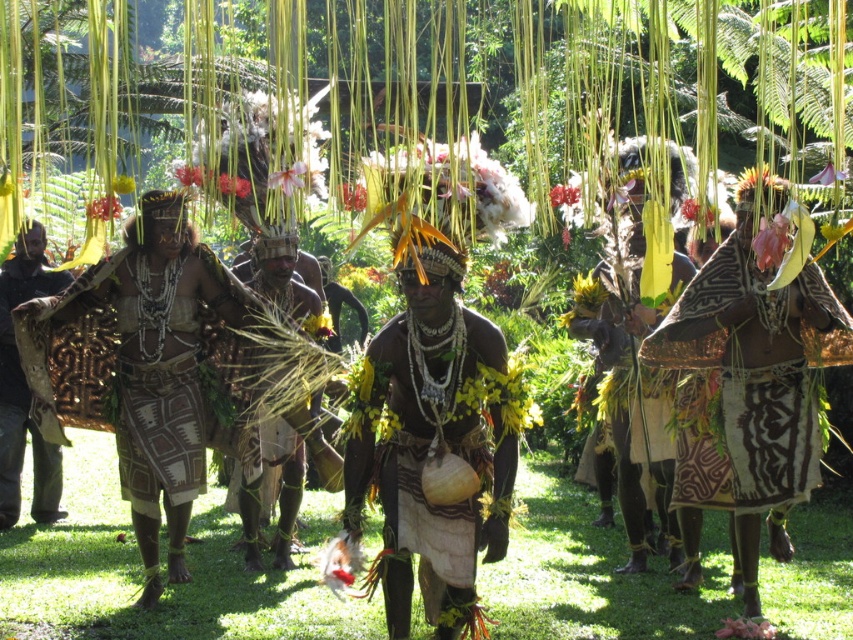
Which is behind, point (154, 481) or point (467, 602)?

The point (154, 481) is behind.

Looking at this image, is brown woven skirt at center positioned before matte black headdress at center?

No, it is behind matte black headdress at center.

Does point (85, 330) come behind point (515, 440)?

Yes, it is.

Identify the location of brown woven skirt at center. (149, 368).

Describe the element at coordinates (149, 368) in the screenshot. I see `brown woven skirt at center` at that location.

Does brown woven skirt at center have a larger size compared to matte brown grass skirt at center?

Yes, brown woven skirt at center is bigger than matte brown grass skirt at center.

Measure the distance between point (55, 400) and camera.

Point (55, 400) is 7.41 meters away from camera.

Locate an element on the screen. brown woven skirt at center is located at coordinates (149, 368).

Does matte brown cloth at left appear over matte brown grass skirt at center?

Indeed, matte brown cloth at left is positioned over matte brown grass skirt at center.

Looking at this image, is matte brown cloth at left positioned at the back of matte brown grass skirt at center?

Yes, matte brown cloth at left is behind matte brown grass skirt at center.

I want to click on matte brown cloth at left, so click(24, 387).